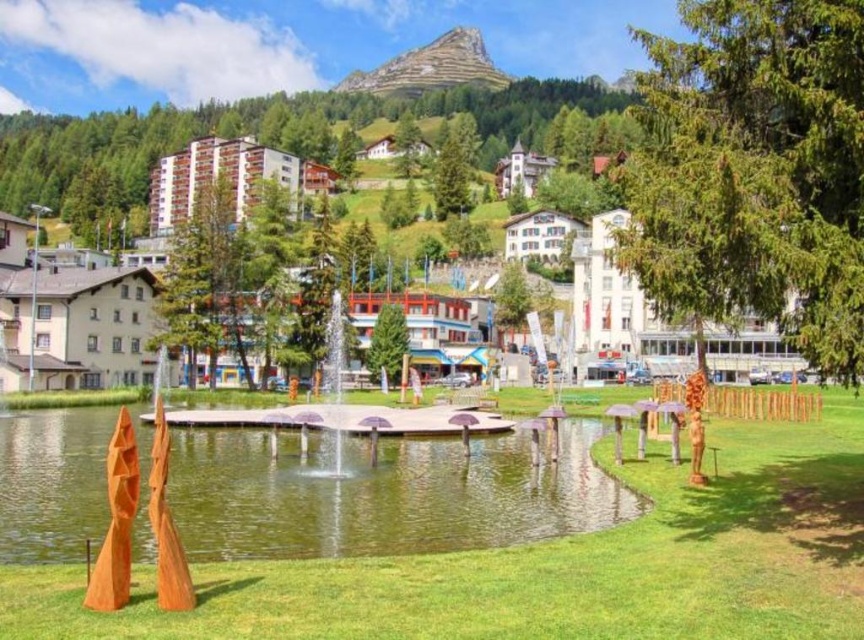
Question: Is green grass at center smaller than green matte tree at upper center?

Choices:
 (A) yes
 (B) no

Answer: (A)

Question: Which point is farther from the camera taking this photo?

Choices:
 (A) tap(842, 589)
 (B) tap(448, 163)
 (C) tap(810, 36)

Answer: (B)

Question: Is matte wooden sculptures at center to the left of green matte tree at center from the viewer's perspective?

Choices:
 (A) yes
 (B) no

Answer: (A)

Question: Which point appears closest to the camera in this image?

Choices:
 (A) (378, 337)
 (B) (563, 189)

Answer: (A)

Question: Which is farther from the green grass at center?

Choices:
 (A) green coniferous tree at right
 (B) green matte tree at center
 (C) green water at center

Answer: (B)

Question: Does green grass at center come behind green coniferous tree at right?

Choices:
 (A) no
 (B) yes

Answer: (A)